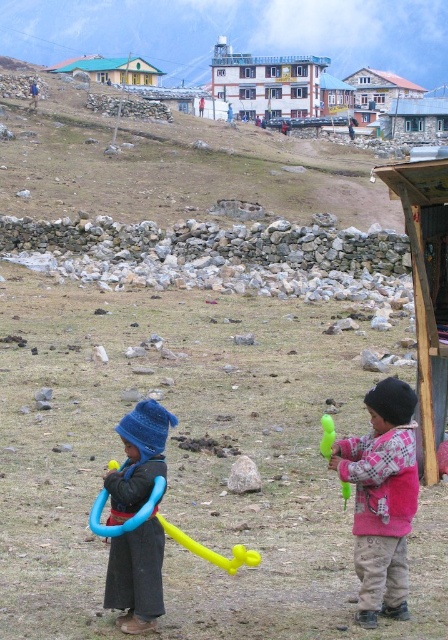
Does point (393, 522) come closer to viewer compared to point (220, 44)?

Yes, it is in front of point (220, 44).

You are a GUI agent. You are given a task and a screenshot of the screen. Output one action in this format:
    pyautogui.click(x=<x>, y=<y>)
    Task: Click on the pink fleece jacket at center
    Image resolution: width=448 pixels, height=640 pixels.
    Given the screenshot: What is the action you would take?
    pyautogui.click(x=382, y=499)

Is point (380, 516) farther from camera compared to point (323, 60)?

No, it is not.

I want to click on pink fleece jacket at center, so click(382, 499).

Can you confirm if white painted wood at upper center is wider than green corrugated metal hut at upper left?

No, white painted wood at upper center is not wider than green corrugated metal hut at upper left.

Who is more distant from viewer, (257, 90) or (60, 65)?

Point (60, 65)

Locate an element on the screen. white painted wood at upper center is located at coordinates (267, 83).

Which is above, white painted wood at upper center or wooden cabin at upper center?

Positioned higher is wooden cabin at upper center.

Between white painted wood at upper center and wooden cabin at upper center, which one appears on the right side from the viewer's perspective?

Positioned to the right is wooden cabin at upper center.

What do you see at coordinates (267, 83) in the screenshot? I see `white painted wood at upper center` at bounding box center [267, 83].

You are a GUI agent. You are given a task and a screenshot of the screen. Output one action in this format:
    pyautogui.click(x=<x>, y=<y>)
    Task: Click on the white painted wood at upper center
    The width and height of the screenshot is (448, 640).
    Given the screenshot: What is the action you would take?
    pyautogui.click(x=267, y=83)